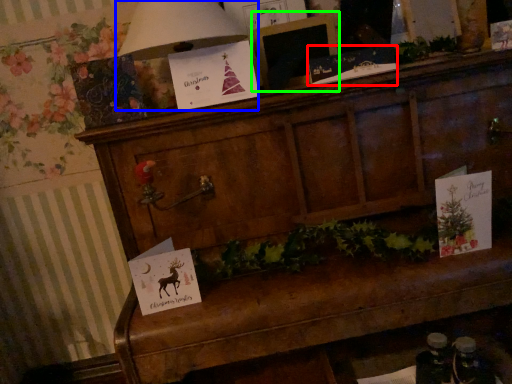
Question: Which object is the closest to the christmas card (highlighted by a red box)? Choose among these: lamp (highlighted by a blue box) or picture frame (highlighted by a green box).

Choices:
 (A) lamp
 (B) picture frame

Answer: (B)